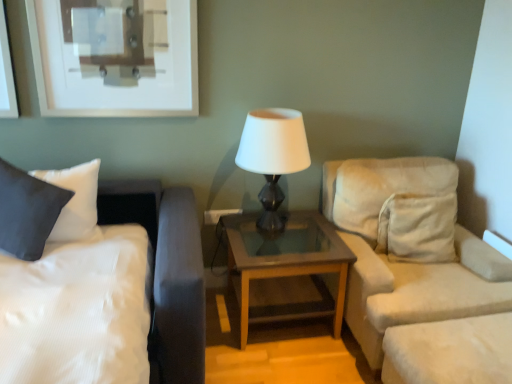
Identify the location of matte black pillow at left. (27, 211).

The height and width of the screenshot is (384, 512). Describe the element at coordinates (106, 296) in the screenshot. I see `satin white bed at left` at that location.

Describe the element at coordinates (404, 262) in the screenshot. I see `beige fabric studio couch at right` at that location.

Identify the location of matte black pillow at left. (27, 211).

Is beige fabric studio couch at right positioned far away from white glossy lamp at center?

They are positioned close to each other.

From a real-world perspective, is beige fabric studio couch at right beneath white glossy lamp at center?

Yes.

Is beige fabric studio couch at right shorter than white glossy lamp at center?

No.

Is point (456, 262) more distant than point (293, 248)?

No, (456, 262) is in front of (293, 248).

Who is taller, beige fabric studio couch at right or brown wood/glass table at center?

With more height is beige fabric studio couch at right.

Is brown wood/glass table at center at the back of beige fabric studio couch at right?

No, beige fabric studio couch at right is not facing away from brown wood/glass table at center.

Does beige fabric studio couch at right appear on the left side of brown wood/glass table at center?

In fact, beige fabric studio couch at right is to the right of brown wood/glass table at center.

From a real-world perspective, relative to matte black pillow at left, is satin white bed at left vertically above or below?

Clearly, from a real-world perspective, satin white bed at left is below matte black pillow at left.

Which is closer to the camera, (108, 194) or (63, 196)?

Point (108, 194) is positioned farther from the camera compared to point (63, 196).

Between satin white bed at left and matte black pillow at left, which one appears on the right side from the viewer's perspective?

From the viewer's perspective, satin white bed at left appears more on the right side.

Is matte black pillow at left completely or partially inside satin white bed at left?

Yes.

Considering the relative positions of brown wood/glass table at center and white glossy lamp at center in the image provided, is brown wood/glass table at center to the left of white glossy lamp at center from the viewer's perspective?

No.

Considering the sizes of objects brown wood/glass table at center and white glossy lamp at center in the image provided, who is smaller, brown wood/glass table at center or white glossy lamp at center?

With smaller size is white glossy lamp at center.

Is brown wood/glass table at center positioned behind white glossy lamp at center?

Yes, it is behind white glossy lamp at center.

From the image's perspective, which object appears higher, satin white bed at left or white glossy lamp at center?

white glossy lamp at center, from the image's perspective.

Consider the image. From a real-world perspective, which object stands above the other?

From a 3D spatial view, white glossy lamp at center is above.

Is point (186, 266) more distant than point (276, 215)?

No.

Can we say satin white bed at left lies outside white glossy lamp at center?

Yes.

Considering the positions of objects white glossy lamp at center and beige fabric studio couch at right in the image provided, who is more to the right, white glossy lamp at center or beige fabric studio couch at right?

beige fabric studio couch at right.

From the picture: Are white glossy lamp at center and beige fabric studio couch at right making contact?

white glossy lamp at center and beige fabric studio couch at right are not in contact.

Do you think white glossy lamp at center is within beige fabric studio couch at right, or outside of it?

white glossy lamp at center is located beyond the bounds of beige fabric studio couch at right.

Between white glossy lamp at center and brown wood/glass table at center, which one appears on the left side from the viewer's perspective?

From the viewer's perspective, white glossy lamp at center appears more on the left side.

Who is bigger, white glossy lamp at center or brown wood/glass table at center?

brown wood/glass table at center is bigger.

Where is `lamp that is above the brown wood/glass table at center (from the image's perspective)`? lamp that is above the brown wood/glass table at center (from the image's perspective) is located at coordinates (273, 156).

Is white glossy lamp at center not within brown wood/glass table at center?

white glossy lamp at center is positioned outside brown wood/glass table at center.

In the image, there is a beige fabric studio couch at right. Find the location of `lamp above it (from the image's perspective)`. lamp above it (from the image's perspective) is located at coordinates (273, 156).

The height and width of the screenshot is (384, 512). In order to click on studio couch on the right side of brown wood/glass table at center in this screenshot , I will do `click(404, 262)`.

When comparing their distances from satin white bed at left, does matte black pillow at left or beige fabric studio couch at right seem further?

beige fabric studio couch at right.

When comparing their distances from beige fabric studio couch at right, does brown wood/glass table at center or satin white bed at left seem closer?

brown wood/glass table at center lies closer to beige fabric studio couch at right than the other object.

Estimate the real-world distances between objects in this image. Which object is further from brown wood/glass table at center, satin white bed at left or beige fabric studio couch at right?

satin white bed at left is further to brown wood/glass table at center.

From the image, which object appears to be nearer to satin white bed at left, beige fabric studio couch at right or white glossy lamp at center?

white glossy lamp at center is closer to satin white bed at left.

Looking at the image, which one is located further to brown wood/glass table at center, matte black pillow at left or beige fabric studio couch at right?

matte black pillow at left lies further to brown wood/glass table at center than the other object.

When comparing their distances from beige fabric studio couch at right, does white glossy lamp at center or satin white bed at left seem further?

The object further to beige fabric studio couch at right is satin white bed at left.

Estimate the real-world distances between objects in this image. Which object is further from matte black pillow at left, white glossy lamp at center or beige fabric studio couch at right?

The object further to matte black pillow at left is beige fabric studio couch at right.

Based on their spatial positions, is satin white bed at left or beige fabric studio couch at right further from matte black pillow at left?

beige fabric studio couch at right is further to matte black pillow at left.

This screenshot has height=384, width=512. What are the coordinates of `bed situated between matte black pillow at left and beige fabric studio couch at right from left to right` in the screenshot? It's located at (106, 296).

Image resolution: width=512 pixels, height=384 pixels. I want to click on nightstand situated between white glossy lamp at center and beige fabric studio couch at right from left to right, so click(x=283, y=266).

Identify the location of lamp situated between satin white bed at left and beige fabric studio couch at right from left to right. (273, 156).

You are a GUI agent. You are given a task and a screenshot of the screen. Output one action in this format:
    pyautogui.click(x=<x>, y=<y>)
    Task: Click on the lamp between matte black pillow at left and brown wood/glass table at center in the horizontal direction
    The image size is (512, 384).
    Given the screenshot: What is the action you would take?
    pyautogui.click(x=273, y=156)